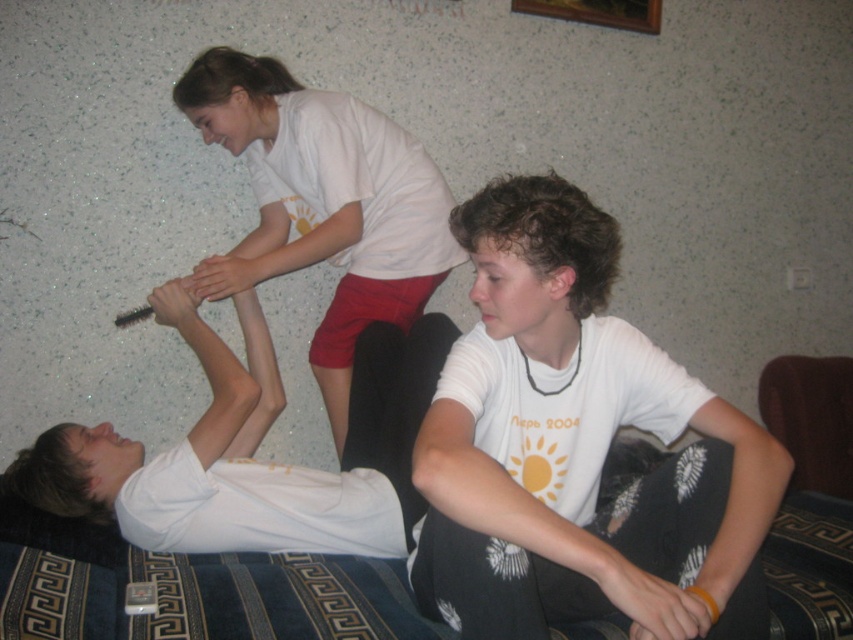
Which is behind, point (798, 516) or point (325, 141)?

Point (798, 516)

What are the coordinates of `dark blue fabric couch at lower center` in the screenshot? It's located at (189, 589).

Can you confirm if white matte shirt at center is positioned below white matte shirt at upper center?

Yes, white matte shirt at center is below white matte shirt at upper center.

Measure the distance between white matte shirt at center and camera.

white matte shirt at center and camera are 3.40 feet apart from each other.

Who is more distant from viewer, (611, 280) or (339, 435)?

The point (611, 280) is behind.

Locate an element on the screen. white matte shirt at center is located at coordinates (579, 444).

Does point (558, 580) lie behind point (187, 620)?

That is False.

Is point (585, 353) in front of point (96, 561)?

Yes, it is in front of point (96, 561).

Does point (692, 630) come behind point (78, 609)?

No.

Locate an element on the screen. The width and height of the screenshot is (853, 640). white matte shirt at center is located at coordinates [x=579, y=444].